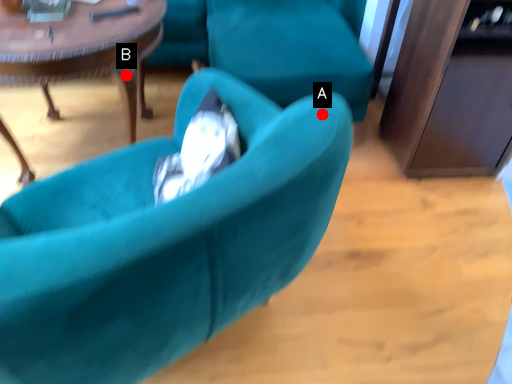
Question: Two points are circled on the image, labeled by A and B beside each circle. Among these points, which one is farthest from the camera?

Choices:
 (A) A is further
 (B) B is further

Answer: (B)